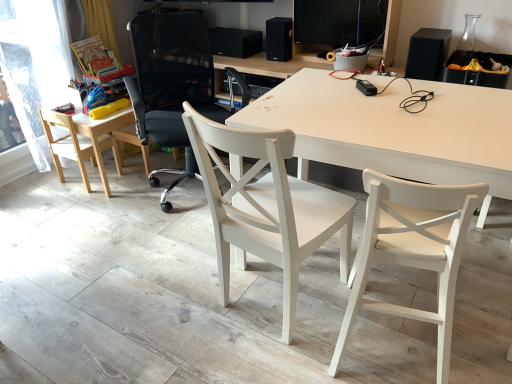
At what (x,y) coordinates should I click in order to perform the action: click on vacant area located to the right-hand side of white matte chair at center, placed as the 4th chair when sorted from left to right. Please return your answer as a coordinate pair (x, y). The image size is (512, 384). Looking at the image, I should click on (478, 320).